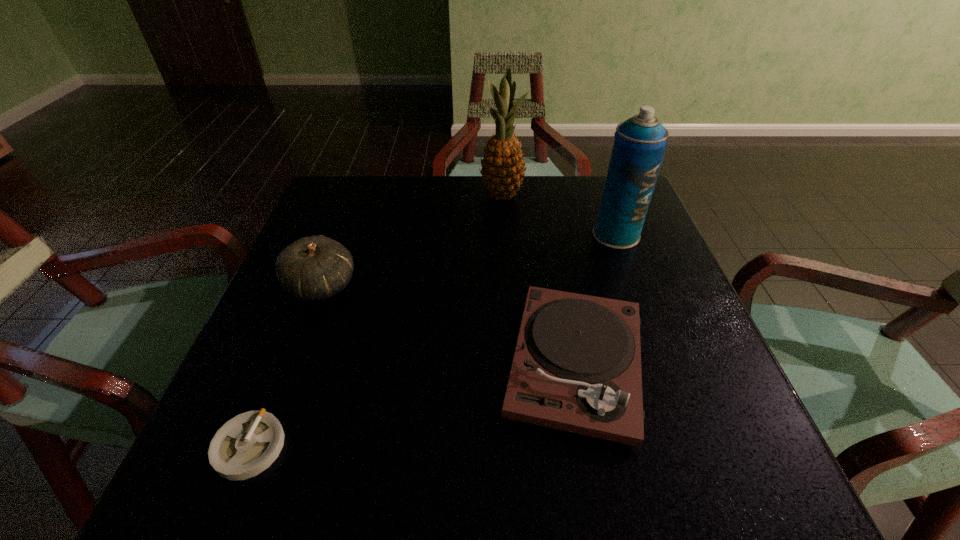
The image size is (960, 540). In order to click on object located at the near right corner in this screenshot , I will do `click(576, 367)`.

Locate an element on the screen. The image size is (960, 540). blank area at the far edge is located at coordinates (383, 206).

You are a GUI agent. You are given a task and a screenshot of the screen. Output one action in this format:
    pyautogui.click(x=<x>, y=<y>)
    Task: Click on the vacant space at the near edge of the desktop
    The image size is (960, 540).
    Given the screenshot: What is the action you would take?
    pyautogui.click(x=334, y=443)

The height and width of the screenshot is (540, 960). In the image, there is a desktop. Find the location of `vacant space at the left edge`. vacant space at the left edge is located at coordinates (326, 308).

Identify the location of vacant space at the right edge of the desktop. The height and width of the screenshot is (540, 960). (723, 428).

At what (x,y) coordinates should I click in order to perform the action: click on blank space at the far left corner of the desktop. Please return your answer as a coordinate pair (x, y). Looking at the image, I should click on (346, 181).

Where is `vacant space at the near right corner`? vacant space at the near right corner is located at coordinates (685, 454).

Find the location of `empty space that is in between the shortest object and the third shortest object`. empty space that is in between the shortest object and the third shortest object is located at coordinates (285, 366).

The height and width of the screenshot is (540, 960). I want to click on vacant space in between the pineapple and the third shortest object, so click(412, 240).

The image size is (960, 540). Find the location of `free space between the pineapple and the ashtray`. free space between the pineapple and the ashtray is located at coordinates (375, 321).